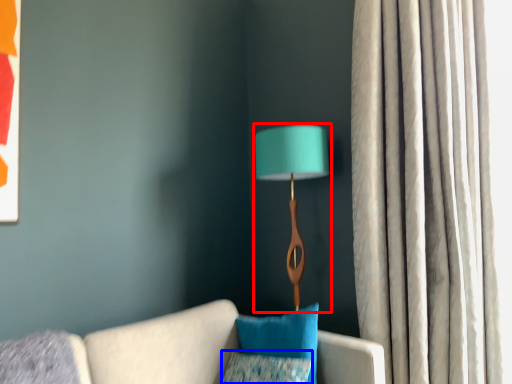
Question: Which point is closer to the camera, lamp (highlighted by a red box) or pillow (highlighted by a blue box)?

Choices:
 (A) lamp
 (B) pillow

Answer: (B)